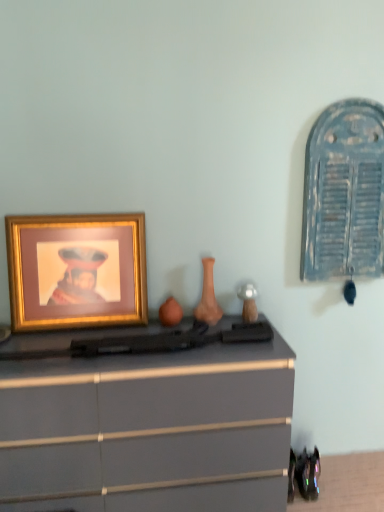
Image resolution: width=384 pixels, height=512 pixels. I want to click on free space in front of gold metallic picture frame at left, so click(x=74, y=344).